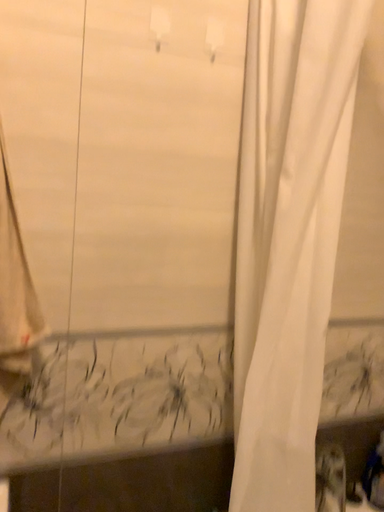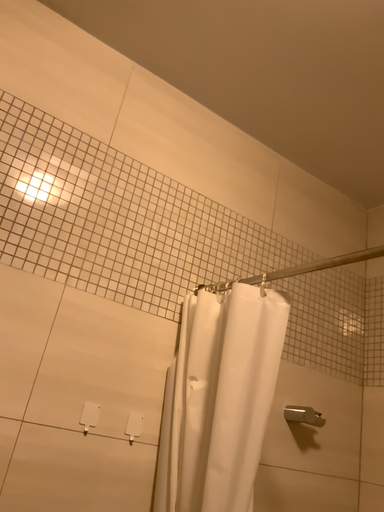
Question: How did the camera likely rotate when shooting the video?

Choices:
 (A) rotated left
 (B) rotated right

Answer: (B)